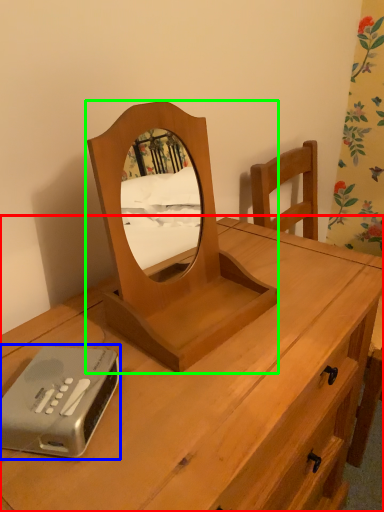
Question: Considering the real-world distances, which object is farthest from desk (highlighted by a red box)? gadget (highlighted by a blue box) or mirror (highlighted by a green box)?

Choices:
 (A) gadget
 (B) mirror

Answer: (A)